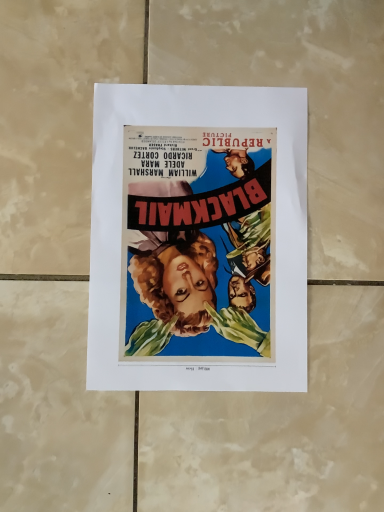
The height and width of the screenshot is (512, 384). Describe the element at coordinates (198, 239) in the screenshot. I see `watercolor painting of a movie poster at center` at that location.

Where is `watercolor painting of a movie poster at center`? This screenshot has width=384, height=512. watercolor painting of a movie poster at center is located at coordinates (198, 239).

Locate an element on the screen. watercolor painting of a movie poster at center is located at coordinates pyautogui.click(x=198, y=239).